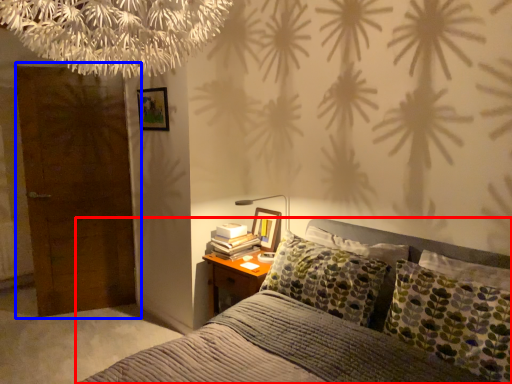
Question: Which object appears farthest to the camera in this image, bed (highlighted by a red box) or door (highlighted by a blue box)?

Choices:
 (A) bed
 (B) door

Answer: (B)